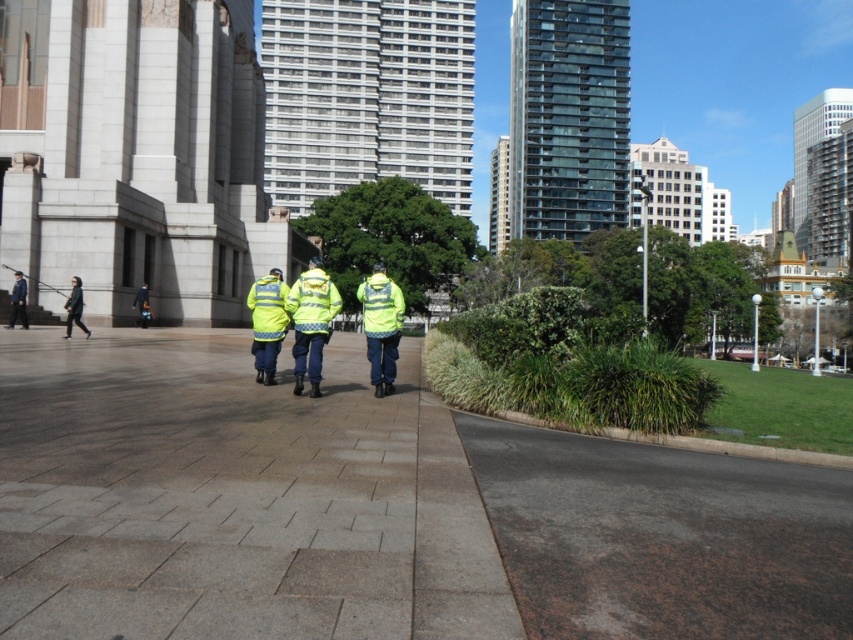
Is point (787, 547) closer to camera compared to point (380, 316)?

Yes, point (787, 547) is closer to viewer.

Can you confirm if black asphalt road at lower right is smaller than high-visibility yellow jacket at center?

Indeed, black asphalt road at lower right has a smaller size compared to high-visibility yellow jacket at center.

Who is more forward, (654, 516) or (380, 365)?

Point (654, 516) is in front.

Locate an element on the screen. The image size is (853, 640). black asphalt road at lower right is located at coordinates (662, 538).

Which is behind, point (308, 358) or point (384, 300)?

The point (384, 300) is more distant.

Which of these two, high-visibility reflective jacket at center or high-visibility yellow jacket at center, stands taller?

With more height is high-visibility yellow jacket at center.

Between point (292, 356) and point (383, 301), which one is positioned behind?

Point (292, 356)

Identify the location of high-visibility reflective jacket at center. (311, 323).

Between yellow reflective jackets at center and high-visibility reflective jacket at center, which one appears on the right side from the viewer's perspective?

From the viewer's perspective, high-visibility reflective jacket at center appears more on the right side.

Can you confirm if yellow reflective jackets at center is wider than high-visibility reflective jacket at center?

Yes.

Is point (318, 314) more distant than point (305, 346)?

No, it is not.

Identify the location of yellow reflective jackets at center. (311, 323).